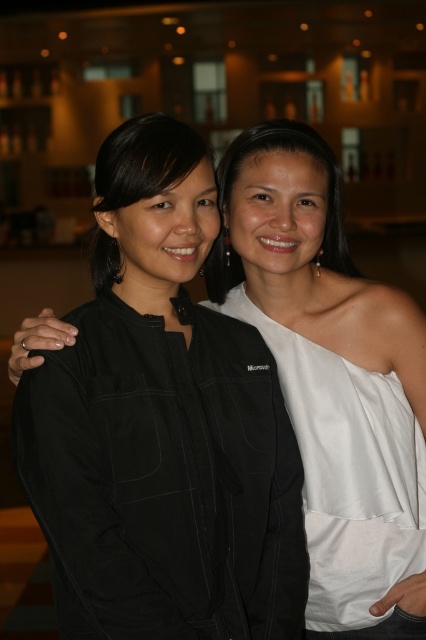
Based on the photo, you are at a party and want to take a photo with the white satin dress at center and the matte white dress at center. Since you can only focus on one dress in the photo, which one will be in focus if you aim your camera at the center of the image?

The white satin dress at center will be in focus because it is positioned under the matte white dress at center, meaning it is closer to the camera.

You are a photographer at an event and need to capture a group photo. You see the white satin dress at center and the matte black jacket at left. Which object has a wider silhouette when viewed from the front?

The white satin dress at center has a wider silhouette than the matte black jacket at left because its width is larger.

You are organizing a charity event and need to display two items on a shelf. The matte black jacket at left and the matte white dress at center must be placed side by side. Given that the shelf has limited space, which item should you place first to ensure both fit properly?

The matte black jacket at left has a smaller size compared to the matte white dress at center. To ensure both items fit on the shelf, place the larger matte white dress at center first, then the smaller matte black jacket at left next to it.